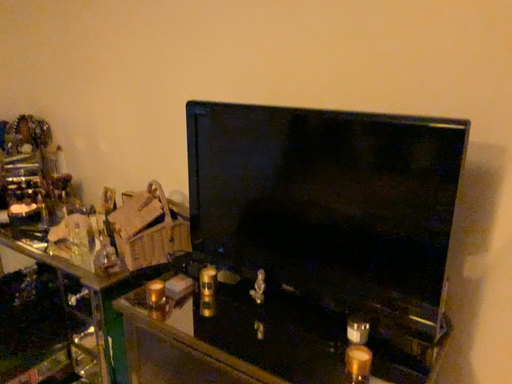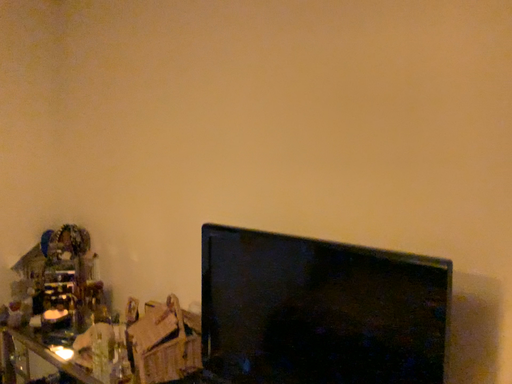
Question: Which way did the camera rotate in the video?

Choices:
 (A) rotated downward
 (B) rotated upward

Answer: (B)